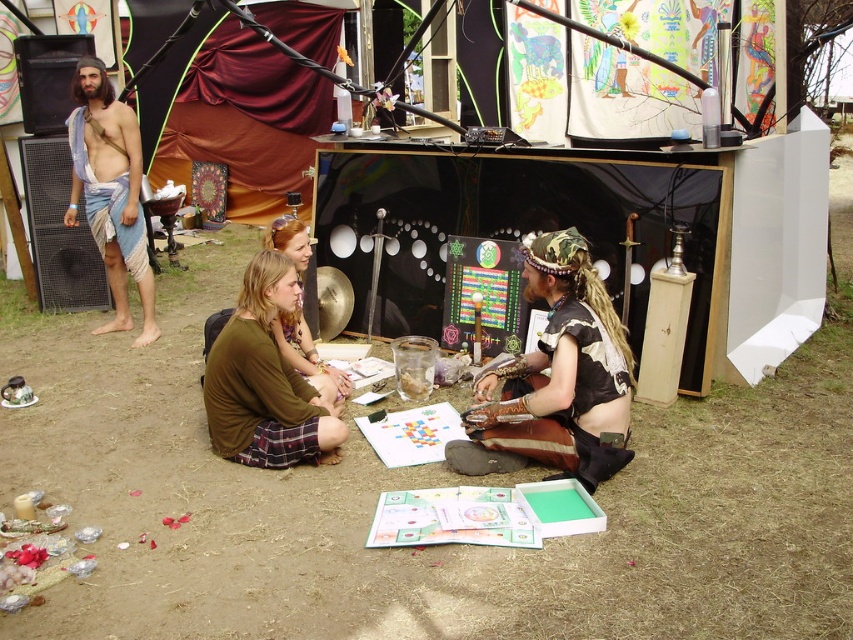
Question: Based on their relative distances, which object is nearer to the black leather skirt at center?

Choices:
 (A) brown plaid skirt at center
 (B) blue fabric cloth at left
 (C) brown fabric shirt at center

Answer: (A)

Question: Is brown plaid skirt at center smaller than blue fabric cloth at left?

Choices:
 (A) no
 (B) yes

Answer: (B)

Question: Which object is the closest to the black leather skirt at center?

Choices:
 (A) blue fabric cloth at left
 (B) brown fabric shirt at center
 (C) brown plaid skirt at center

Answer: (C)

Question: Observing the image, what is the correct spatial positioning of brown plaid skirt at center in reference to blue fabric cloth at left?

Choices:
 (A) below
 (B) above

Answer: (A)

Question: Which point is closer to the camera?

Choices:
 (A) (90, 72)
 (B) (605, 368)
 (C) (265, 321)

Answer: (B)

Question: Is blue fabric cloth at left below brown fabric shirt at center?

Choices:
 (A) yes
 (B) no

Answer: (B)